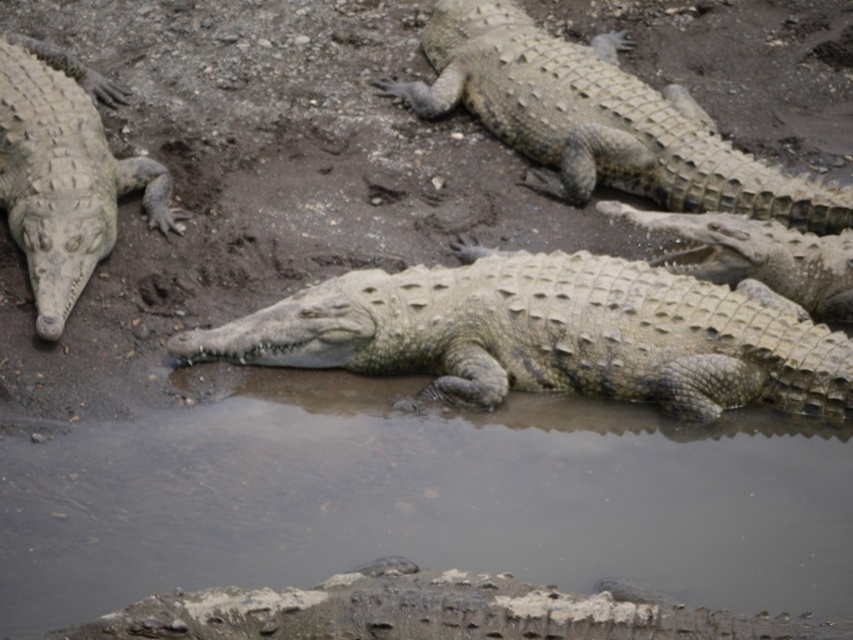
You are a wildlife photographer aiming to capture a closeup shot of the matte gray crocodile at left without getting too close to the water. Can you safely step on the translucent mud puddle at center to get a better angle?

The translucent mud puddle at center is closer to the viewer than the matte gray crocodile at left, so stepping on it would bring you closer to the crocodile. However, approaching a resting crocodile could be dangerous. It is advisable to use a telephoto lens instead of getting closer.

You are a researcher studying crocodiles in their natural habitat. You need to approach the crocodiles to collect data without disturbing them. There is a translucent mud puddle at center in the scene. Based on its location, which direction should you move to avoid stepping on the puddle while approaching the crocodiles?

The translucent mud puddle at center is located at point (422, 499). To avoid stepping on it while approaching the crocodiles, you should move around it either to the left or right side of the puddle.